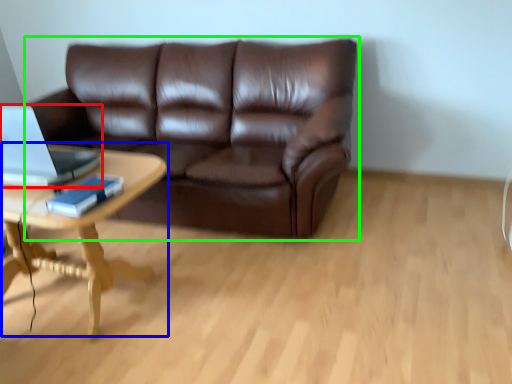
Question: Which object is positioned closest to laptop (highlighted by a red box)? Select from coffee table (highlighted by a blue box) and studio couch (highlighted by a green box).

Choices:
 (A) coffee table
 (B) studio couch

Answer: (A)